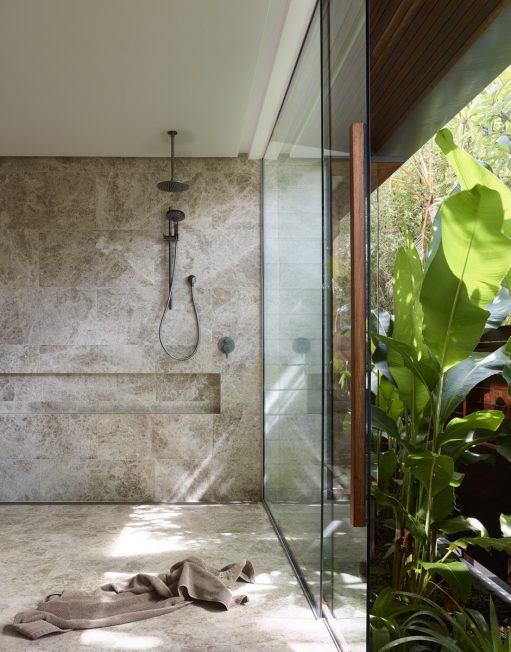
The image size is (511, 652). In order to click on handle on glass in this screenshot , I will do `click(359, 213)`.